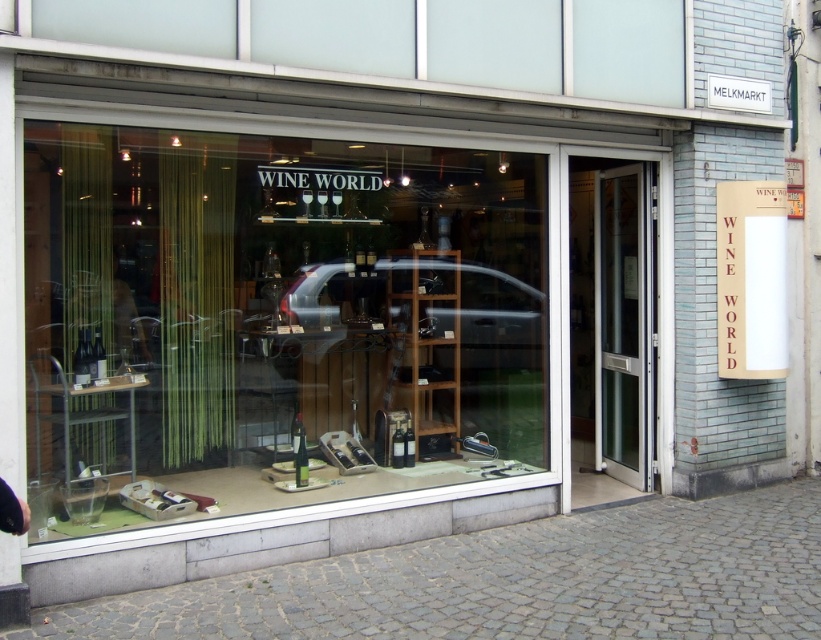
Question: Can you confirm if clear glass wine bottles at center is positioned to the left of gray cobblestone pavement at lower center?

Choices:
 (A) no
 (B) yes

Answer: (B)

Question: Which point is farther to the camera?

Choices:
 (A) (599, 456)
 (B) (190, 179)
 (C) (508, 614)

Answer: (A)

Question: Which point is farther from the camera taking this photo?

Choices:
 (A) (57, 493)
 (B) (606, 426)
 (C) (813, 576)

Answer: (B)

Question: Can you confirm if clear glass wine bottles at center is positioned above gray cobblestone pavement at lower center?

Choices:
 (A) yes
 (B) no

Answer: (A)

Question: Does clear glass wine bottles at center have a smaller size compared to gray cobblestone pavement at lower center?

Choices:
 (A) yes
 (B) no

Answer: (B)

Question: Which of the following is the closest to the observer?

Choices:
 (A) (705, 552)
 (B) (606, 176)
 (C) (53, 176)

Answer: (A)